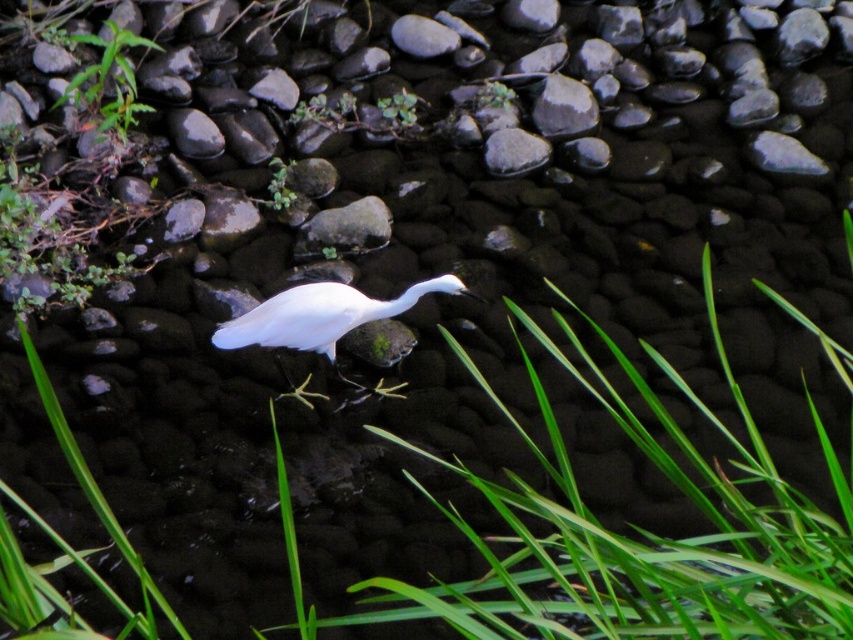
You are a photographer trying to capture the white bird in the center of the image. There is a green leafy plant at upper left marked by point [108,81]. To avoid the plant from blocking the bird in your shot, should you move your camera position to the left or right?

You should move your camera position to the right to avoid the green leafy plant at upper left marked by point [108,81] blocking the bird in the center. Moving right would shift the plant out of the frame or reduce its obstruction.

You are standing at the edge of the water and want to walk to the point labeled point (328, 304). There is also a point labeled point (143, 108) in the scene. Which point is closer to your current position?

Point (328, 304) is closer to the viewer than point (143, 108), so the point labeled point (328, 304) is closer to your current position.

You are an ornithologist observing the scene. You need to determine if the green leafy plant at upper left can provide enough shade to protect your equipment placed near the smooth gray rock at center. Based on their widths, can the plant cover the rock?

The green leafy plant at upper left might be wider than the smooth gray rock at center, so there is a possibility that the plant could provide sufficient coverage. However, without exact measurements, this remains uncertain.